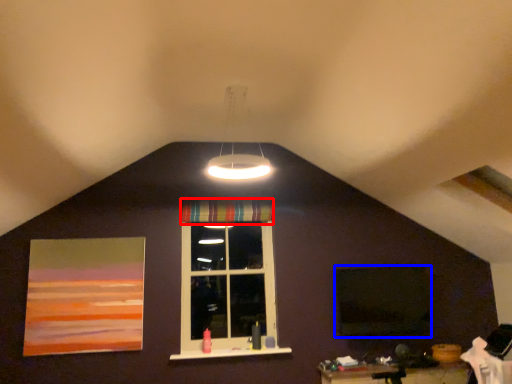
Question: Which object appears farthest to the camera in this image, curtain (highlighted by a red box) or window screen (highlighted by a blue box)?

Choices:
 (A) curtain
 (B) window screen

Answer: (A)